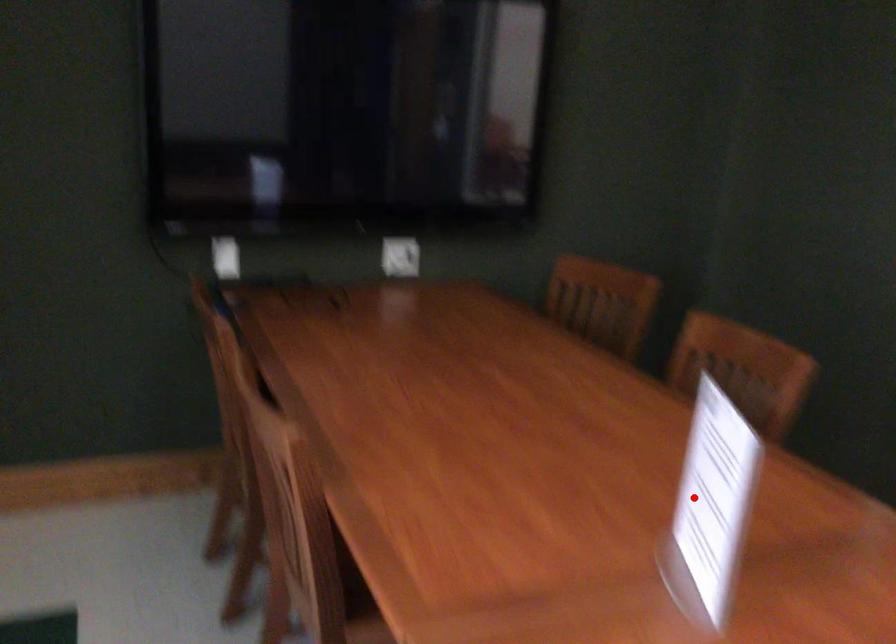
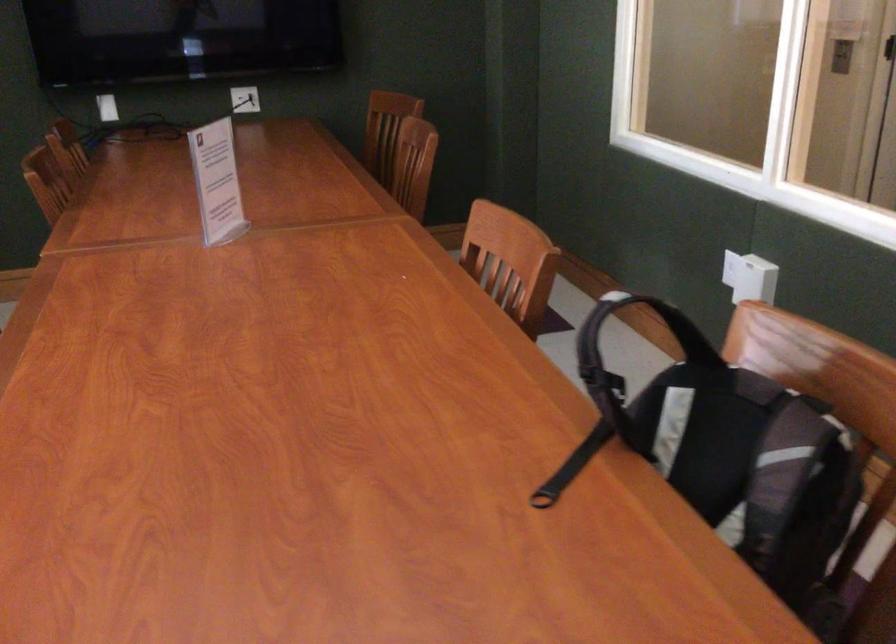
Question: I am providing you with two images of the same scene from different viewpoints. A red point is shown in image1. For the corresponding object point in image2, is it positioned nearer or farther from the camera?

Choices:
 (A) Nearer
 (B) Farther

Answer: (B)